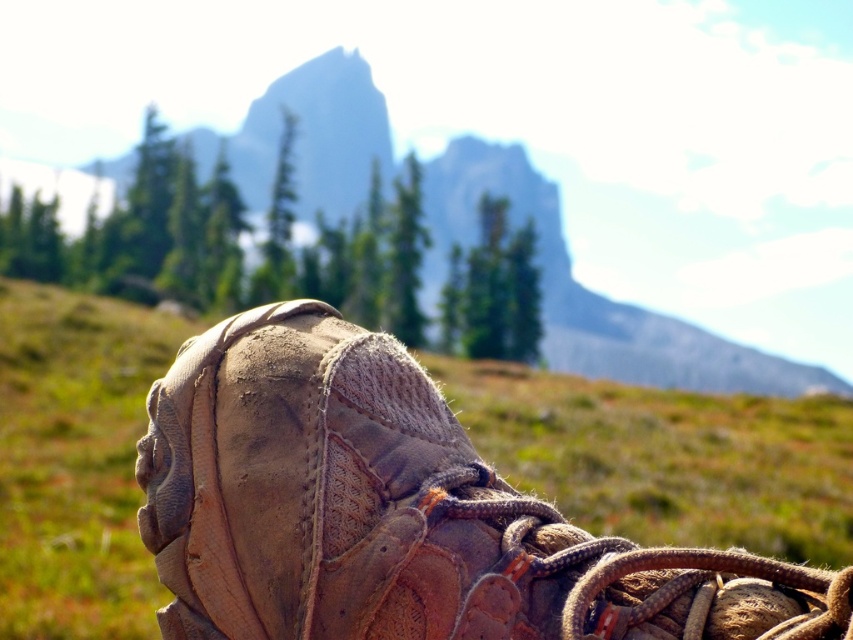
Between leather boot at center and brown leather boot at center, which one has less height?

With less height is leather boot at center.

Describe the element at coordinates (399, 513) in the screenshot. I see `leather boot at center` at that location.

Which is in front, point (699, 586) or point (200, 141)?

Point (699, 586) is in front.

The width and height of the screenshot is (853, 640). In order to click on leather boot at center in this screenshot , I will do `click(399, 513)`.